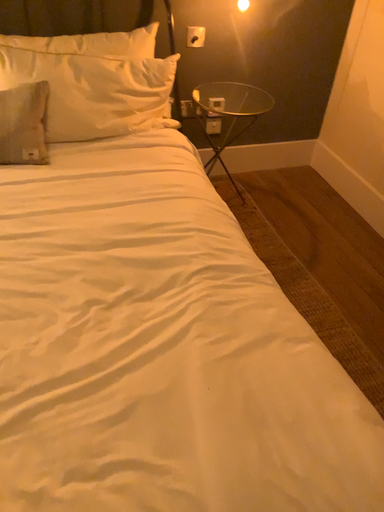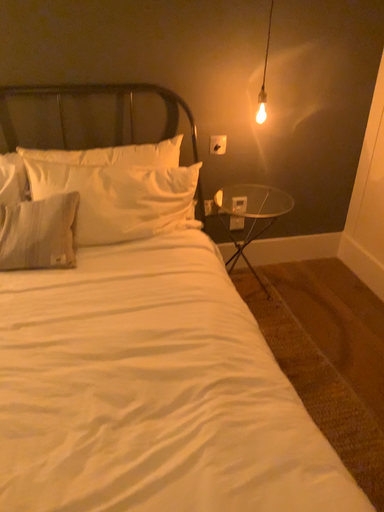
Question: Which way did the camera rotate in the video?

Choices:
 (A) rotated upward
 (B) rotated downward

Answer: (A)